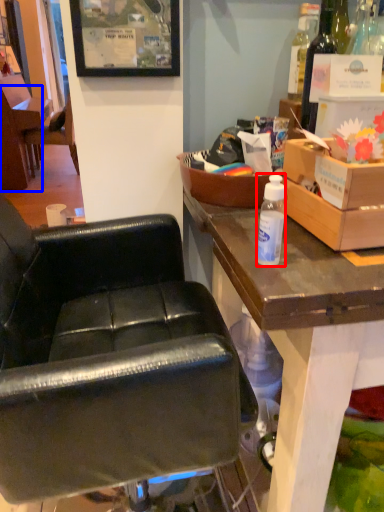
Question: Which point is closer to the camera, bottle (highlighted by a red box) or chair (highlighted by a blue box)?

Choices:
 (A) bottle
 (B) chair

Answer: (A)